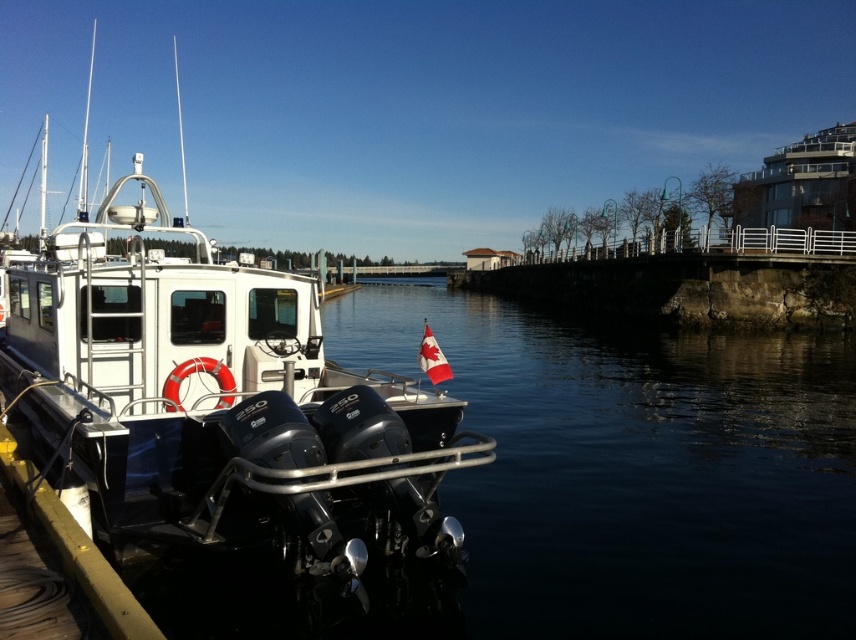
Question: Observing the image, what is the correct spatial positioning of dark blue water at lower left in reference to white glossy boat at left?

Choices:
 (A) above
 (B) below

Answer: (B)

Question: Among these points, which one is nearest to the camera?

Choices:
 (A) (321, 534)
 (B) (531, 412)

Answer: (A)

Question: In this image, where is dark blue water at lower left located relative to white glossy boat at left?

Choices:
 (A) left
 (B) right

Answer: (B)

Question: Is dark blue water at lower left thinner than white glossy boat at left?

Choices:
 (A) no
 (B) yes

Answer: (B)

Question: Which point is farther from the camera taking this photo?

Choices:
 (A) tap(643, 461)
 (B) tap(293, 387)

Answer: (A)

Question: Which object appears closest to the camera in this image?

Choices:
 (A) white glossy boat at left
 (B) dark blue water at lower left

Answer: (A)